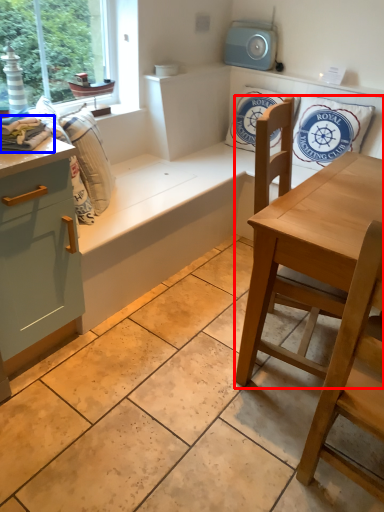
Question: Which point is further to the camera, chair (highlighted by a red box) or material (highlighted by a blue box)?

Choices:
 (A) chair
 (B) material

Answer: (B)